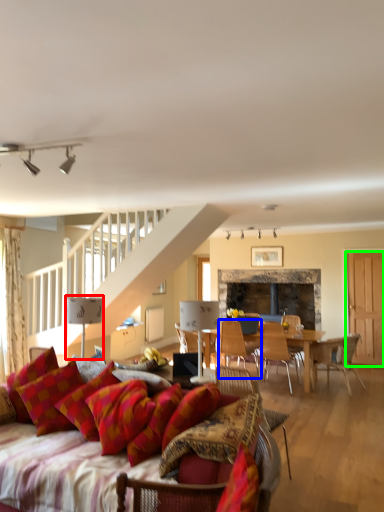
Question: Which object is the farthest from lamp (highlighted by a red box)? Choose among these: chair (highlighted by a blue box) or glass door (highlighted by a green box).

Choices:
 (A) chair
 (B) glass door

Answer: (B)